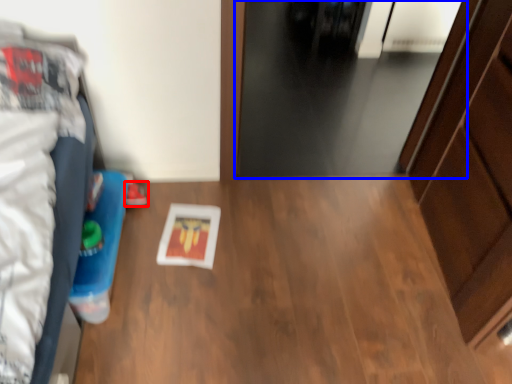
Question: Which object is closer to the camera taking this photo, footwear (highlighted by a red box) or door (highlighted by a blue box)?

Choices:
 (A) footwear
 (B) door

Answer: (A)